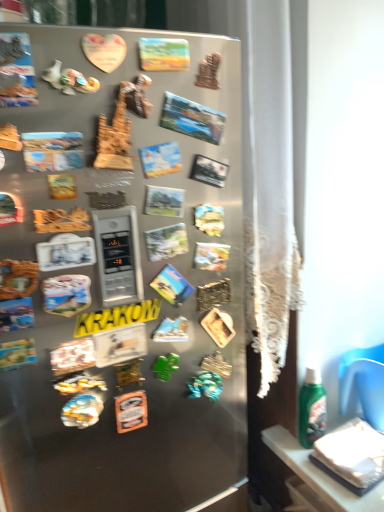
Question: Does satin silver fridge at center turn towards matte paper comic book at center, marked as the 6th comic book in a top-to-bottom arrangement?

Choices:
 (A) yes
 (B) no

Answer: (A)

Question: From a real-world perspective, is satin silver fridge at center physically above matte paper comic book at center, which is counted as the third comic book, starting from the bottom?

Choices:
 (A) no
 (B) yes

Answer: (A)

Question: Is satin silver fridge at center positioned before matte paper comic book at center, which is counted as the third comic book, starting from the bottom?

Choices:
 (A) no
 (B) yes

Answer: (B)

Question: Is satin silver fridge at center turned away from matte paper comic book at center, which is counted as the third comic book, starting from the bottom?

Choices:
 (A) no
 (B) yes

Answer: (B)

Question: Can you confirm if satin silver fridge at center is positioned to the right of matte paper comic book at center, marked as the 6th comic book in a top-to-bottom arrangement?

Choices:
 (A) yes
 (B) no

Answer: (B)

Question: Would you say matte plastic comic book at center, positioned as the 1th comic book in bottom-to-top order, is to the left or to the right of matte plastic comic book at center, the 6th comic book ordered from the bottom, in the picture?

Choices:
 (A) left
 (B) right

Answer: (B)

Question: Considering the positions of matte plastic comic book at center, the 8th comic book from the top, and matte plastic comic book at center, the 6th comic book ordered from the bottom, in the image, is matte plastic comic book at center, the 8th comic book from the top, taller or shorter than matte plastic comic book at center, the 6th comic book ordered from the bottom,?

Choices:
 (A) tall
 (B) short

Answer: (A)

Question: Relative to matte plastic comic book at center, the 6th comic book ordered from the bottom, is matte plastic comic book at center, the 8th comic book from the top, in front or behind?

Choices:
 (A) front
 (B) behind

Answer: (B)

Question: From the image's perspective, is matte plastic comic book at center, positioned as the 1th comic book in bottom-to-top order, located above or below matte plastic comic book at center, arranged as the third comic book when viewed from the top?

Choices:
 (A) above
 (B) below

Answer: (B)

Question: From a real-world perspective, is satin silver fridge at center positioned above or below green matte comic book at center, which appears as the 2th comic book when ordered from the bottom?

Choices:
 (A) below
 (B) above

Answer: (A)

Question: Is satin silver fridge at center in front of or behind green matte comic book at center, the seventh comic book viewed from the top, in the image?

Choices:
 (A) behind
 (B) front

Answer: (B)

Question: Considering the positions of satin silver fridge at center and green matte comic book at center, the seventh comic book viewed from the top, in the image, is satin silver fridge at center taller or shorter than green matte comic book at center, the seventh comic book viewed from the top,?

Choices:
 (A) tall
 (B) short

Answer: (A)

Question: In the image, is satin silver fridge at center on the left side or the right side of green matte comic book at center, which appears as the 2th comic book when ordered from the bottom?

Choices:
 (A) right
 (B) left

Answer: (B)

Question: From a real-world perspective, relative to white paper at lower right, is matte paper comic book at center, which is counted as the third comic book, starting from the bottom, vertically above or below?

Choices:
 (A) below
 (B) above

Answer: (B)

Question: Looking at the image, does matte paper comic book at center, marked as the 6th comic book in a top-to-bottom arrangement, seem bigger or smaller compared to white paper at lower right?

Choices:
 (A) big
 (B) small

Answer: (B)